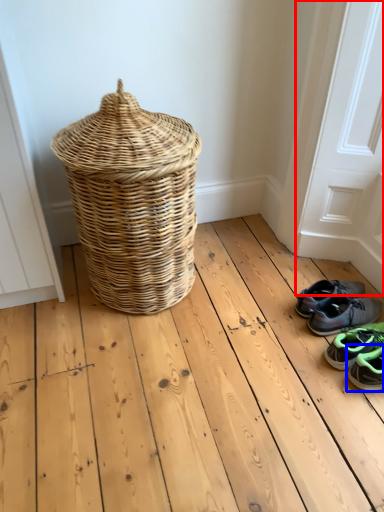
Question: Which point is closer to the camera, screen door (highlighted by a red box) or footwear (highlighted by a blue box)?

Choices:
 (A) screen door
 (B) footwear

Answer: (A)